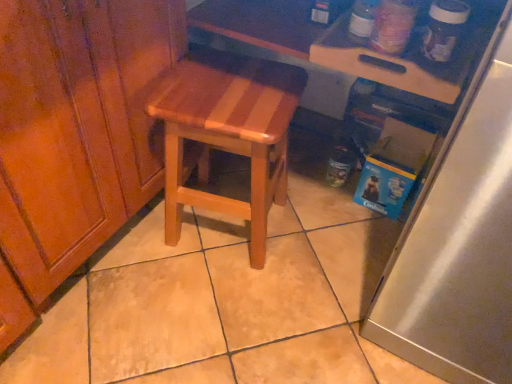
Question: Is wooden cutting board at upper right positioned beyond the bounds of wooden at center?

Choices:
 (A) no
 (B) yes

Answer: (B)

Question: Is wooden cutting board at upper right to the right of wooden at center from the viewer's perspective?

Choices:
 (A) no
 (B) yes

Answer: (B)

Question: Is wooden at center a part of wooden cutting board at upper right?

Choices:
 (A) yes
 (B) no

Answer: (B)

Question: From the image's perspective, is wooden cutting board at upper right under wooden at center?

Choices:
 (A) yes
 (B) no

Answer: (B)

Question: From the image's perspective, would you say wooden cutting board at upper right is positioned over wooden at center?

Choices:
 (A) yes
 (B) no

Answer: (A)

Question: Looking at their shapes, would you say wooden at center is wider or thinner than wooden cutting board at upper right?

Choices:
 (A) thin
 (B) wide

Answer: (A)

Question: Based on their sizes in the image, would you say wooden at center is bigger or smaller than wooden cutting board at upper right?

Choices:
 (A) big
 (B) small

Answer: (A)

Question: Is point (263, 190) positioned closer to the camera than point (431, 79)?

Choices:
 (A) farther
 (B) closer

Answer: (A)

Question: Which is correct: wooden at center is inside wooden cutting board at upper right, or outside of it?

Choices:
 (A) outside
 (B) inside

Answer: (A)

Question: Is satin silver refrigerator at right spatially inside wooden at center, or outside of it?

Choices:
 (A) inside
 (B) outside

Answer: (B)

Question: Considering the positions of point (506, 23) and point (175, 152), is point (506, 23) closer or farther from the camera than point (175, 152)?

Choices:
 (A) farther
 (B) closer

Answer: (B)

Question: Considering the positions of satin silver refrigerator at right and wooden at center in the image, is satin silver refrigerator at right bigger or smaller than wooden at center?

Choices:
 (A) big
 (B) small

Answer: (A)

Question: From the image's perspective, relative to wooden at center, is satin silver refrigerator at right above or below?

Choices:
 (A) above
 (B) below

Answer: (B)

Question: Is point (356, 46) positioned closer to the camera than point (183, 130)?

Choices:
 (A) farther
 (B) closer

Answer: (B)

Question: Looking at their shapes, would you say wooden cutting board at upper right is wider or thinner than wooden at center?

Choices:
 (A) wide
 (B) thin

Answer: (A)